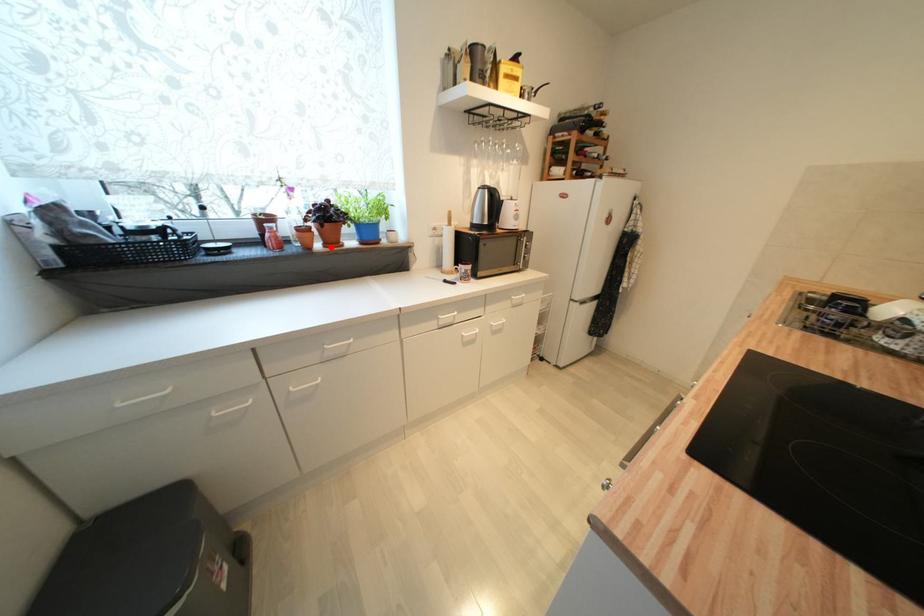
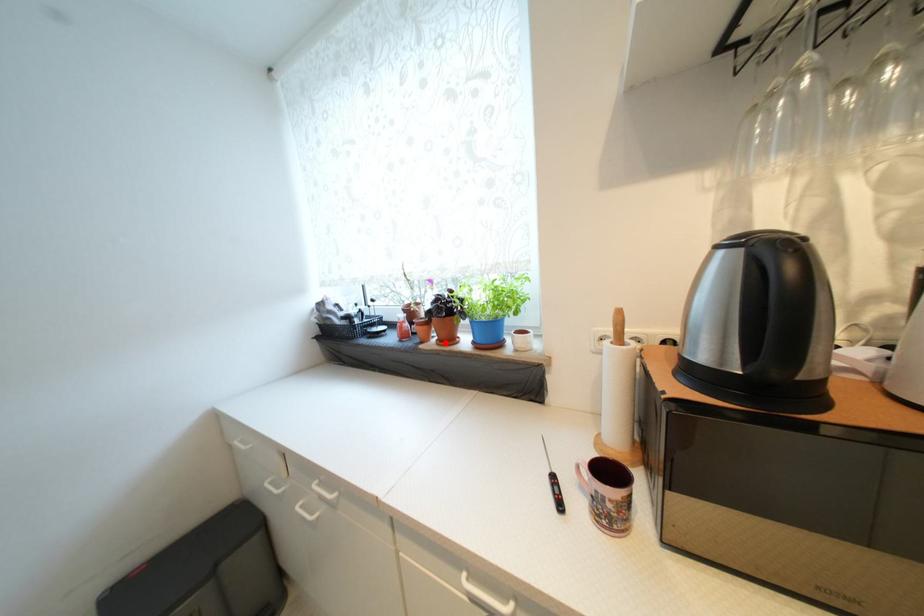
I am providing you with two images of the same scene from different viewpoints. A red point is marked on the first image and another point is marked on the second image. Are the points marked in image1 and image2 representing the same 3D position?

Yes